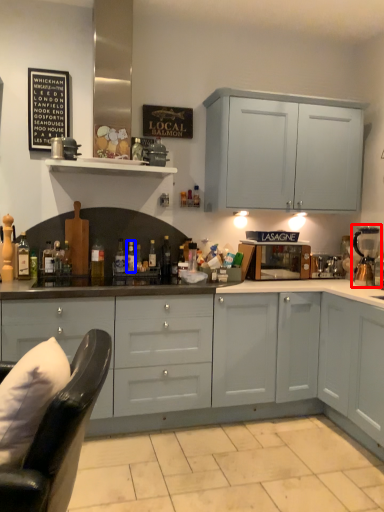
Question: Which object is further to the camera taking this photo, coffee machine (highlighted by a red box) or bottle (highlighted by a blue box)?

Choices:
 (A) coffee machine
 (B) bottle

Answer: (B)